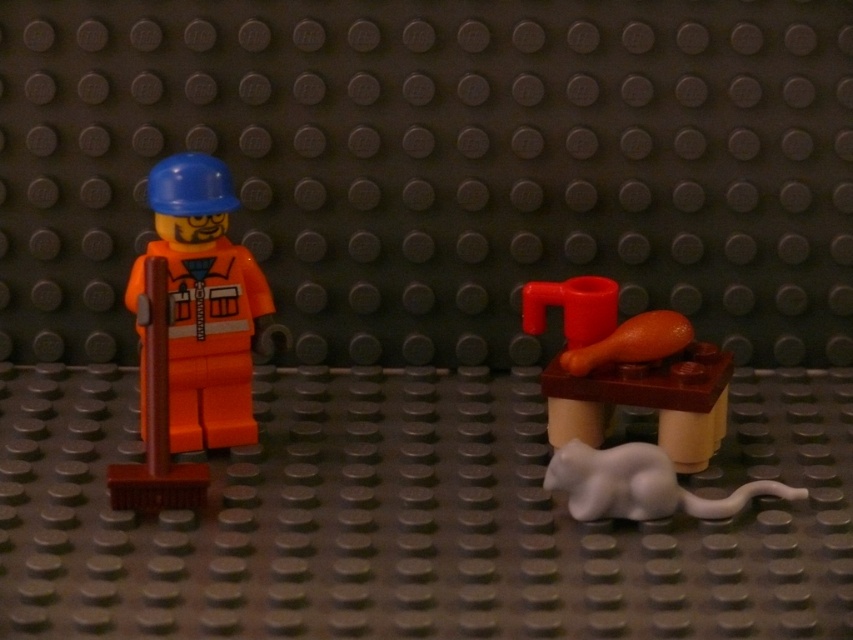
Question: Is smooth brown table at right to the right of white matte mouse at lower right from the viewer's perspective?

Choices:
 (A) yes
 (B) no

Answer: (B)

Question: Which of the following is the farthest from the observer?

Choices:
 (A) smooth brown table at right
 (B) orange matte construction worker at left

Answer: (B)

Question: Is smooth brown table at right below white matte mouse at lower right?

Choices:
 (A) no
 (B) yes

Answer: (A)

Question: Which point is farther to the camera?

Choices:
 (A) (637, 385)
 (B) (250, 257)
 (C) (566, 472)

Answer: (B)

Question: Is smooth brown table at right to the left of orange matte construction worker at left from the viewer's perspective?

Choices:
 (A) yes
 (B) no

Answer: (B)

Question: Which of the following is the farthest from the observer?

Choices:
 (A) white matte mouse at lower right
 (B) smooth brown table at right

Answer: (B)